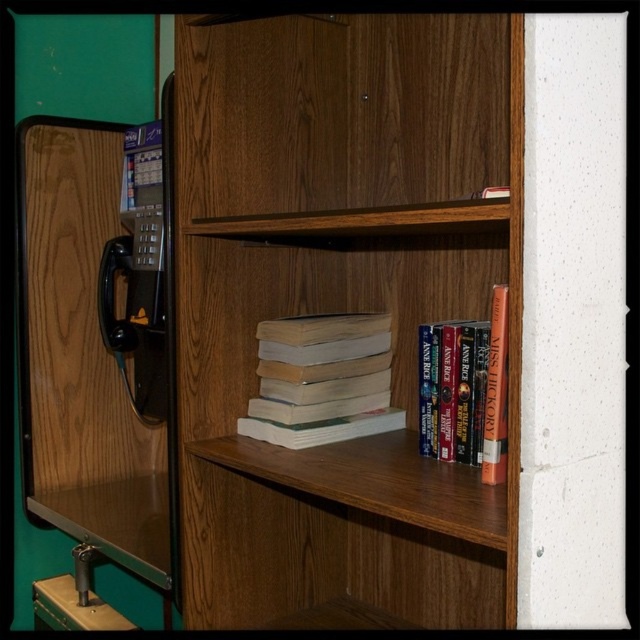
Question: Is white matte book at center wider than black plastic payphone at left?

Choices:
 (A) no
 (B) yes

Answer: (B)

Question: Does black plastic payphone at left have a larger size compared to hardcover book at center?

Choices:
 (A) yes
 (B) no

Answer: (A)

Question: Which is farther from the black plastic payphone at left?

Choices:
 (A) hardcover book at center
 (B) wooden bookcase at center
 (C) white matte book at center

Answer: (A)

Question: Among these objects, which one is farthest from the camera?

Choices:
 (A) black plastic payphone at left
 (B) white matte book at center

Answer: (A)

Question: Is wooden bookcase at center to the right of hardcover book at center from the viewer's perspective?

Choices:
 (A) yes
 (B) no

Answer: (B)

Question: Estimate the real-world distances between objects in this image. Which object is farther from the wooden bookcase at center?

Choices:
 (A) white matte book at center
 (B) metallic black phone at lower left

Answer: (B)